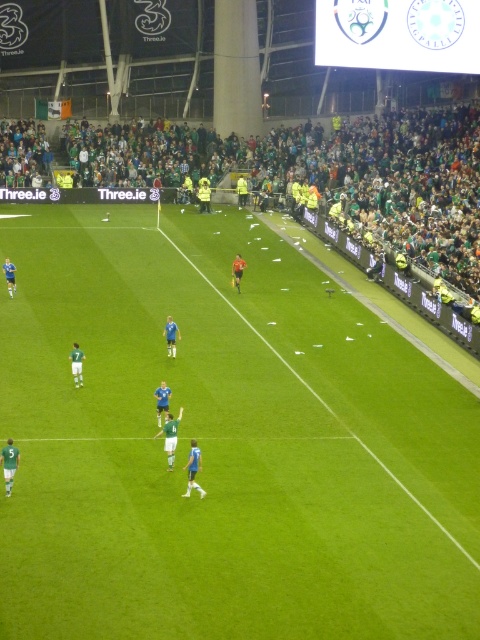
You are a drone operator trying to capture aerial footage of the soccer match. You need to fly your drone from the green grass field at center to the green fabric crowd at upper center. Based on the scene, will your drone have a clear path to fly upwards without obstruction?

The green grass field at center is below the green fabric crowd at upper center, so the drone can fly upwards from the green grass field at center to reach the green fabric crowd at upper center as there is no obstruction mentioned between them.

You are a drone operator trying to capture the best aerial shot of the soccer match. You need to position your drone between the green grass field at center and the green fabric crowd at upper center. Which direction should you fly the drone to move from the crowd towards the field?

The green grass field at center is to the right of the green fabric crowd at upper center, so you should fly the drone to the right to move from the crowd towards the field.